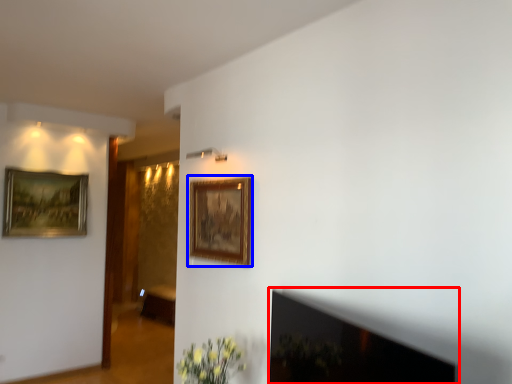
Question: Which of the following is the farthest to the observer, fireplace (highlighted by a red box) or picture frame (highlighted by a blue box)?

Choices:
 (A) fireplace
 (B) picture frame

Answer: (B)